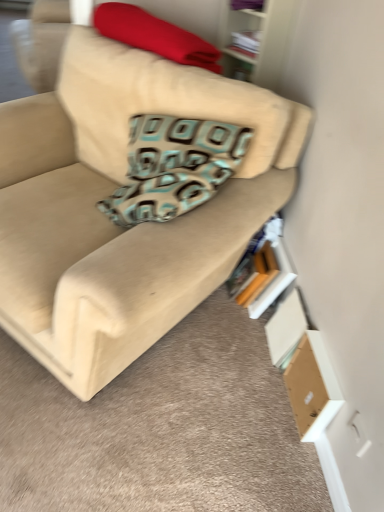
Question: Can you confirm if brown cardboard box at lower right is bigger than white paper book at upper center, arranged as the 2th book when ordered from the bottom?

Choices:
 (A) no
 (B) yes

Answer: (B)

Question: Is white paper book at upper center, arranged as the 2th book when ordered from the bottom, at the back of brown cardboard box at lower right?

Choices:
 (A) yes
 (B) no

Answer: (B)

Question: Is brown cardboard box at lower right facing towards white paper book at upper center, arranged as the 2th book when ordered from the bottom?

Choices:
 (A) yes
 (B) no

Answer: (B)

Question: Is brown cardboard box at lower right further to camera compared to white paper book at upper center, the 1th book viewed from the top?

Choices:
 (A) no
 (B) yes

Answer: (A)

Question: From the image's perspective, is brown cardboard box at lower right located beneath white paper book at upper center, arranged as the 2th book when ordered from the bottom?

Choices:
 (A) no
 (B) yes

Answer: (B)

Question: Is brown cardboard box at lower right smaller than white paper book at upper center, the 1th book viewed from the top?

Choices:
 (A) yes
 (B) no

Answer: (B)

Question: Considering the relative sizes of beige fabric couch at center and red fabric blanket at upper center in the image provided, is beige fabric couch at center shorter than red fabric blanket at upper center?

Choices:
 (A) yes
 (B) no

Answer: (B)

Question: Can you confirm if beige fabric couch at center is bigger than red fabric blanket at upper center?

Choices:
 (A) no
 (B) yes

Answer: (B)

Question: Is beige fabric couch at center at the left side of red fabric blanket at upper center?

Choices:
 (A) yes
 (B) no

Answer: (A)

Question: From a real-world perspective, is beige fabric couch at center located beneath red fabric blanket at upper center?

Choices:
 (A) yes
 (B) no

Answer: (A)

Question: Could you tell me if beige fabric couch at center is facing red fabric blanket at upper center?

Choices:
 (A) yes
 (B) no

Answer: (B)

Question: From the image's perspective, does beige fabric couch at center appear higher than red fabric blanket at upper center?

Choices:
 (A) yes
 (B) no

Answer: (B)

Question: Is white paper book at upper center, the 1th book viewed from the top, at the right side of hardcover book at lower right, the first book from the bottom?

Choices:
 (A) no
 (B) yes

Answer: (A)